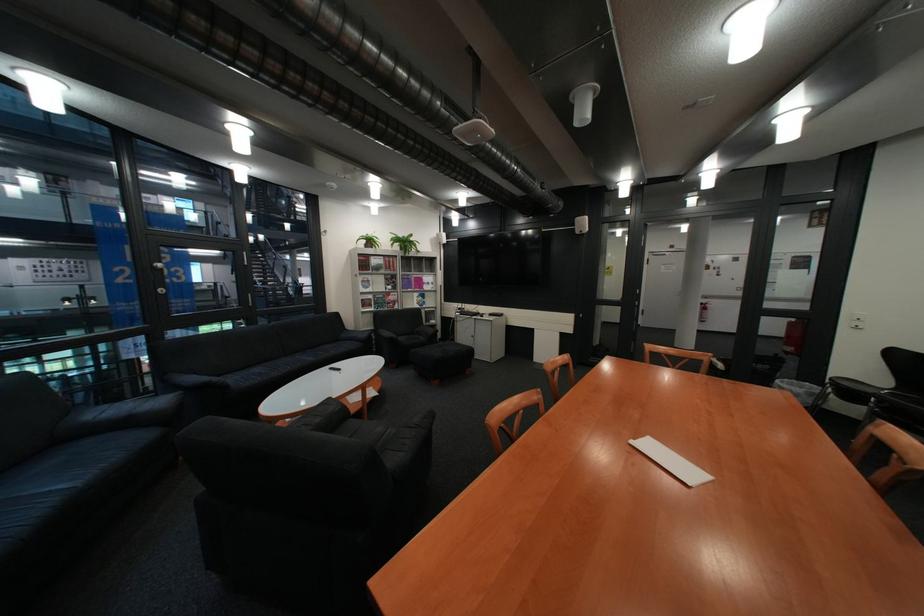
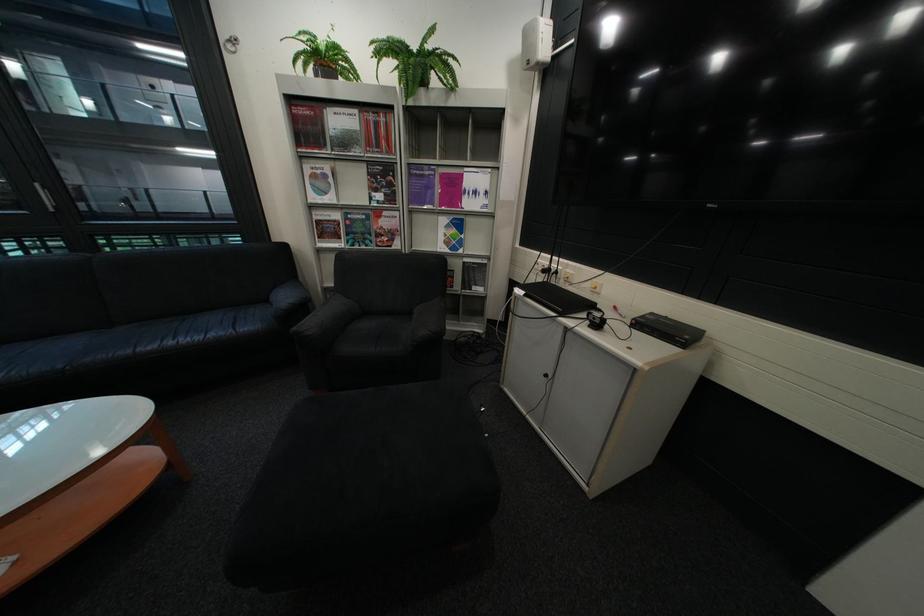
Where in the second image is the point corresponding to the point at 382,246 from the first image?

(333, 78)